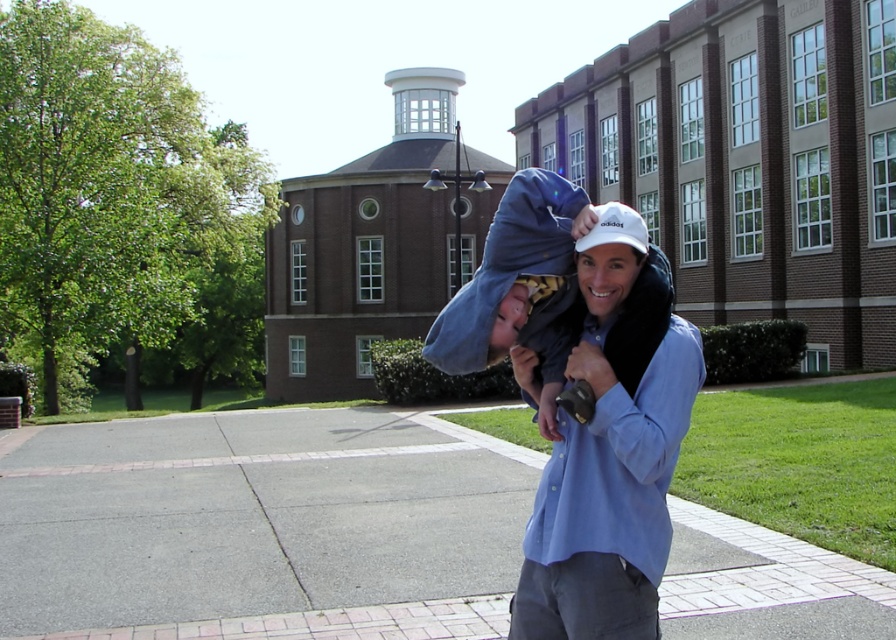
Question: Which of these objects is positioned farthest from the blue cotton shirt at center?

Choices:
 (A) gray concrete pavement at center
 (B) white matte cap at center

Answer: (A)

Question: Is blue cotton shirt at center below white matte cap at center?

Choices:
 (A) no
 (B) yes

Answer: (B)

Question: Among these objects, which one is nearest to the camera?

Choices:
 (A) blue fleece hat at center
 (B) blue cotton shirt at center

Answer: (B)

Question: Among these objects, which one is farthest from the camera?

Choices:
 (A) blue fleece hat at center
 (B) gray concrete pavement at center
 (C) blue cotton shirt at center
 (D) white matte cap at center

Answer: (B)

Question: Is gray concrete pavement at center below white matte cap at center?

Choices:
 (A) no
 (B) yes

Answer: (B)

Question: Does gray concrete pavement at center have a smaller size compared to blue fleece hat at center?

Choices:
 (A) yes
 (B) no

Answer: (B)